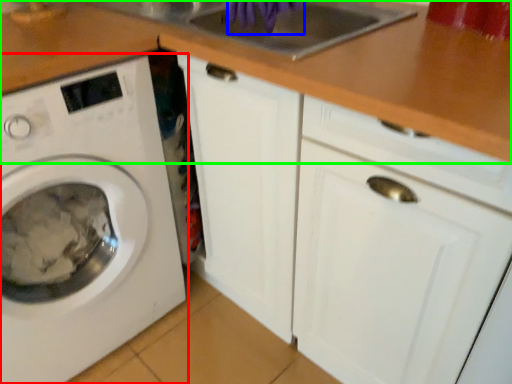
Question: Considering the real-world distances, which object is closest to washing machine (highlighted by a red box)? hand (highlighted by a blue box) or counter top (highlighted by a green box).

Choices:
 (A) hand
 (B) counter top

Answer: (B)